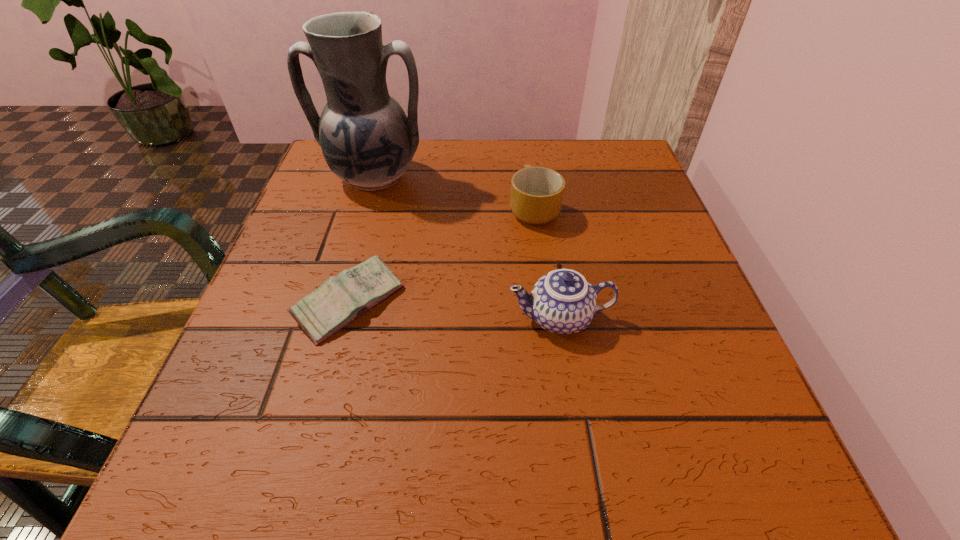
This screenshot has width=960, height=540. In order to click on pitcher in this screenshot , I will do `click(367, 140)`.

At what (x,y) coordinates should I click in order to perform the action: click on chinaware. Please return your answer as a coordinate pair (x, y). Looking at the image, I should click on (562, 302).

Image resolution: width=960 pixels, height=540 pixels. I want to click on mug, so click(x=536, y=196).

Locate an element on the screen. Image resolution: width=960 pixels, height=540 pixels. the shortest object is located at coordinates (341, 299).

Locate an element on the screen. The height and width of the screenshot is (540, 960). free space located on the front-facing side of the pitcher is located at coordinates (349, 261).

Find the location of a particular element. The width and height of the screenshot is (960, 540). free point located from the spout of the third shortest object is located at coordinates (357, 318).

Where is `vacant area situated from the spout of the third shortest object`? The width and height of the screenshot is (960, 540). vacant area situated from the spout of the third shortest object is located at coordinates (345, 318).

The height and width of the screenshot is (540, 960). In order to click on free spot located from the spout of the third shortest object in this screenshot , I will do `click(395, 318)`.

I want to click on vacant area situated on the side with the handle of the mug, so click(x=527, y=159).

The height and width of the screenshot is (540, 960). I want to click on blank space located on the side with the handle of the mug, so click(x=530, y=176).